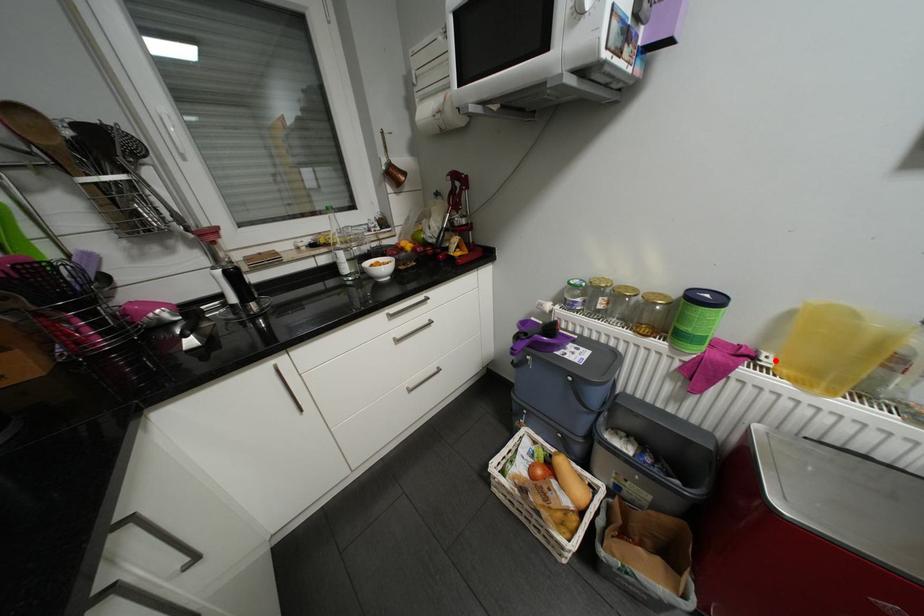
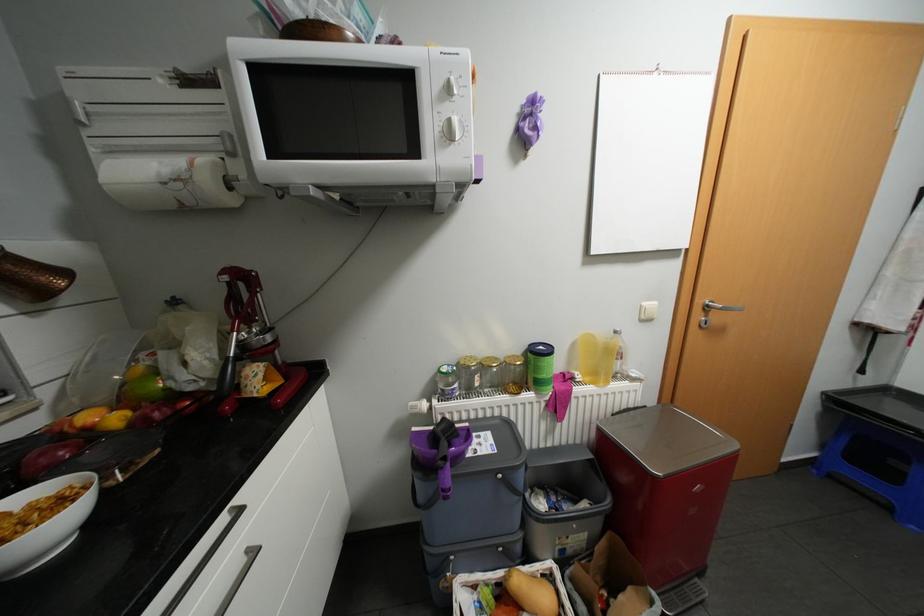
Locate, in the second image, the point that corresponds to the highlighted location in the first image.

(587, 377)